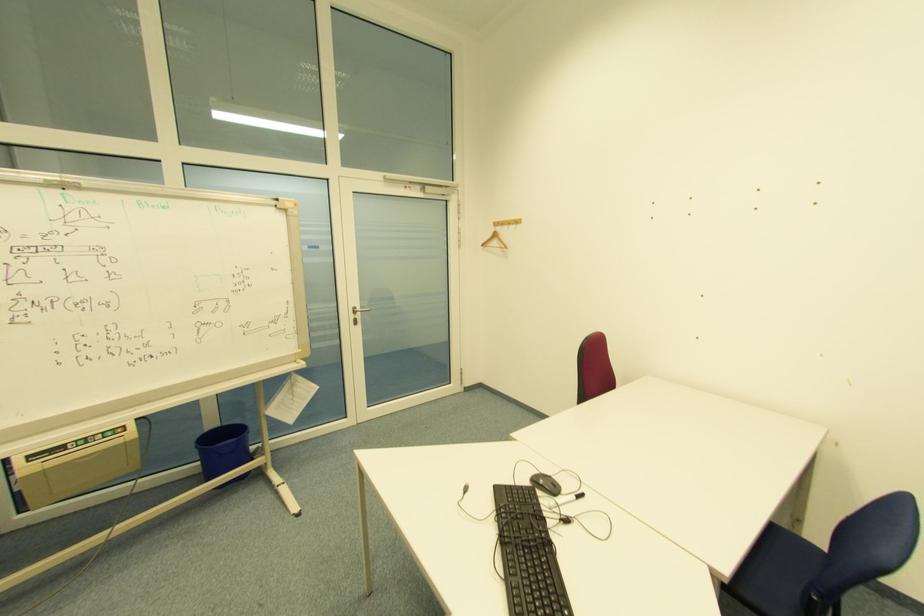
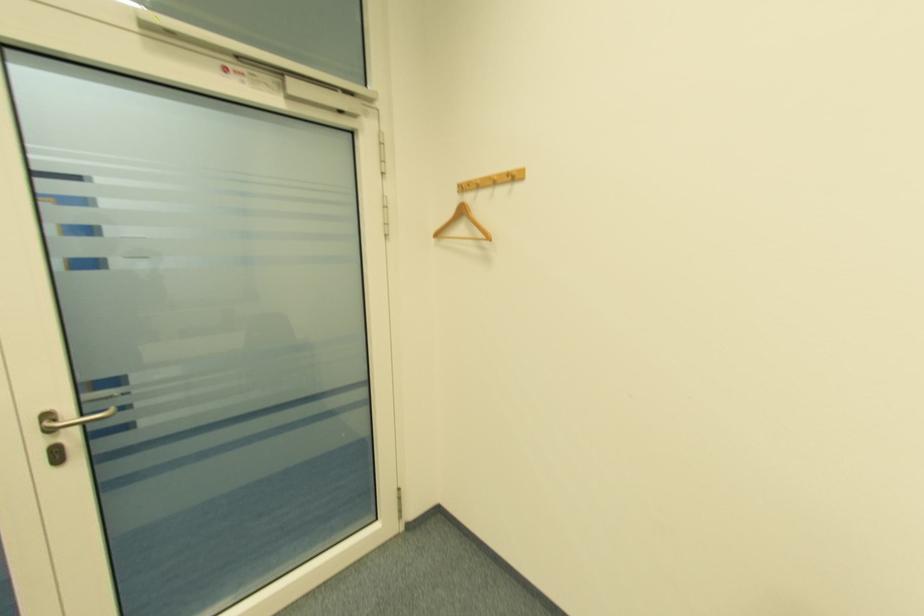
Question: Which direction would the cameraman need to move to produce the second image? Reply with the corresponding letter.

Choices:
 (A) Left
 (B) Right
 (C) Forward
 (D) Backward

Answer: (C)